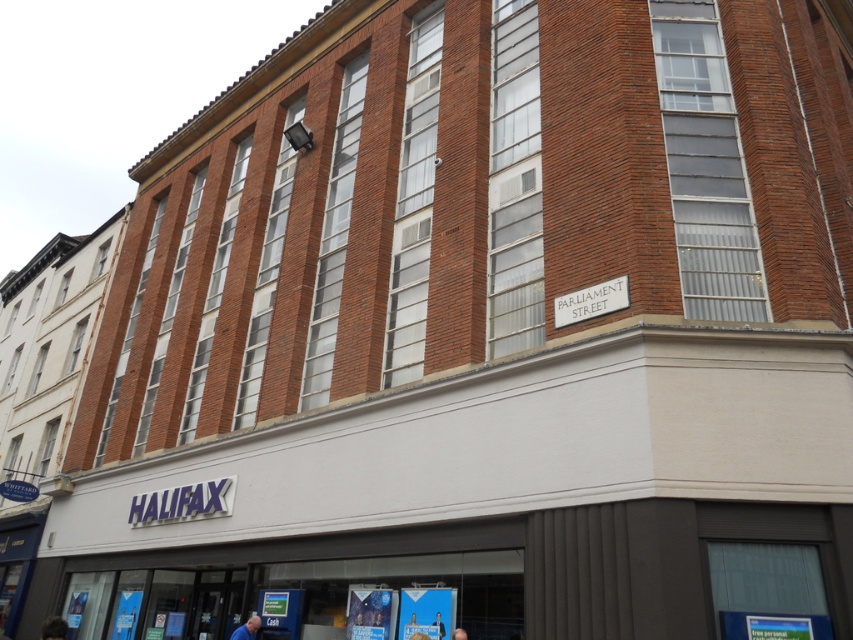
Is point (62, 620) less distant than point (416, 634)?

No, it is behind (416, 634).

Does brown hair at lower left have a smaller size compared to blue fabric person at lower center?

Actually, brown hair at lower left might be larger than blue fabric person at lower center.

This screenshot has width=853, height=640. Find the location of `brown hair at lower left`. brown hair at lower left is located at coordinates (53, 628).

This screenshot has width=853, height=640. What are the coordinates of `brown hair at lower left` in the screenshot? It's located at (53, 628).

Does brown hair at lower left have a greater width compared to blue fabric at lower center?

Indeed, brown hair at lower left has a greater width compared to blue fabric at lower center.

Can you confirm if brown hair at lower left is taller than blue fabric at lower center?

Yes.

Image resolution: width=853 pixels, height=640 pixels. Identify the location of brown hair at lower left. tap(53, 628).

Can you confirm if blue fabric at lower center is thinner than blue fabric head at center?

In fact, blue fabric at lower center might be wider than blue fabric head at center.

Looking at this image, which is below, blue fabric at lower center or blue fabric head at center?

blue fabric at lower center is below.

Between point (244, 637) and point (463, 632), which one is positioned behind?

Point (244, 637)

You are a GUI agent. You are given a task and a screenshot of the screen. Output one action in this format:
    pyautogui.click(x=<x>, y=<y>)
    Task: Click on the blue fabric at lower center
    
    Given the screenshot: What is the action you would take?
    pyautogui.click(x=247, y=628)